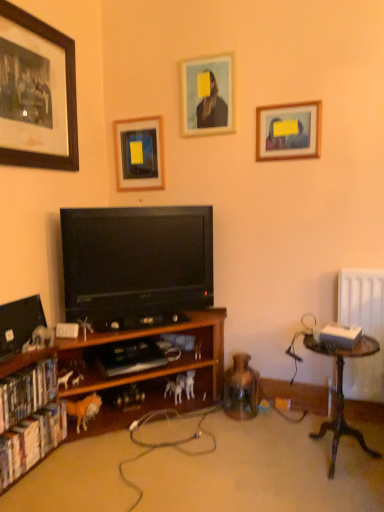
The image size is (384, 512). In order to click on free area in between wooden table at right and wooden bookshelf at left in this screenshot , I will do `click(258, 461)`.